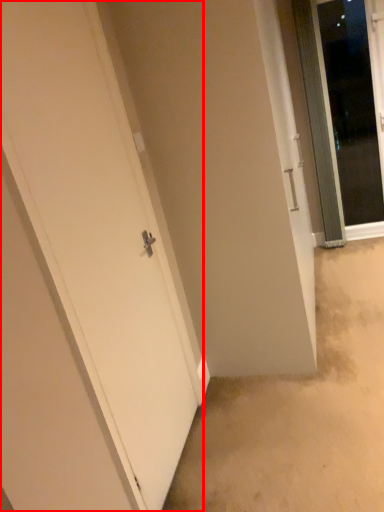
Question: Observing the image, what is the correct spatial positioning of door (annotated by the red box) in reference to door?

Choices:
 (A) left
 (B) right

Answer: (A)